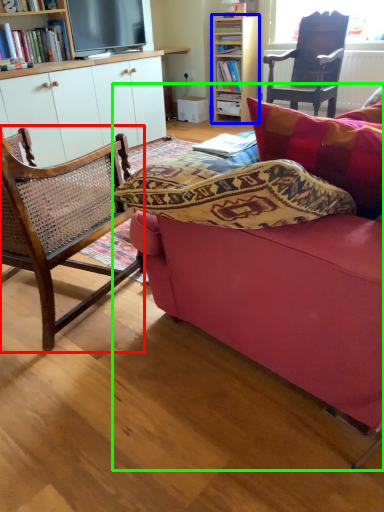
Question: Which is farther away from chair (highlighted by a red box)? bookcase (highlighted by a blue box) or studio couch (highlighted by a green box)?

Choices:
 (A) bookcase
 (B) studio couch

Answer: (A)